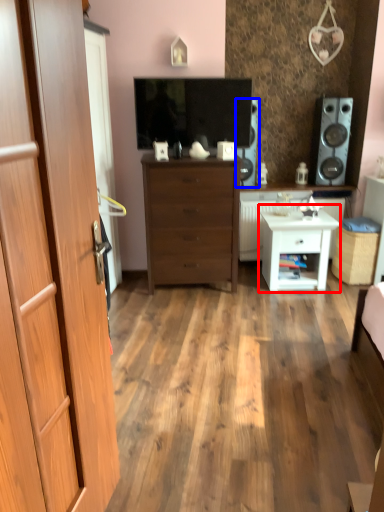
Question: Which of the following is the farthest to the observer, nightstand (highlighted by a red box) or speaker (highlighted by a blue box)?

Choices:
 (A) nightstand
 (B) speaker

Answer: (B)